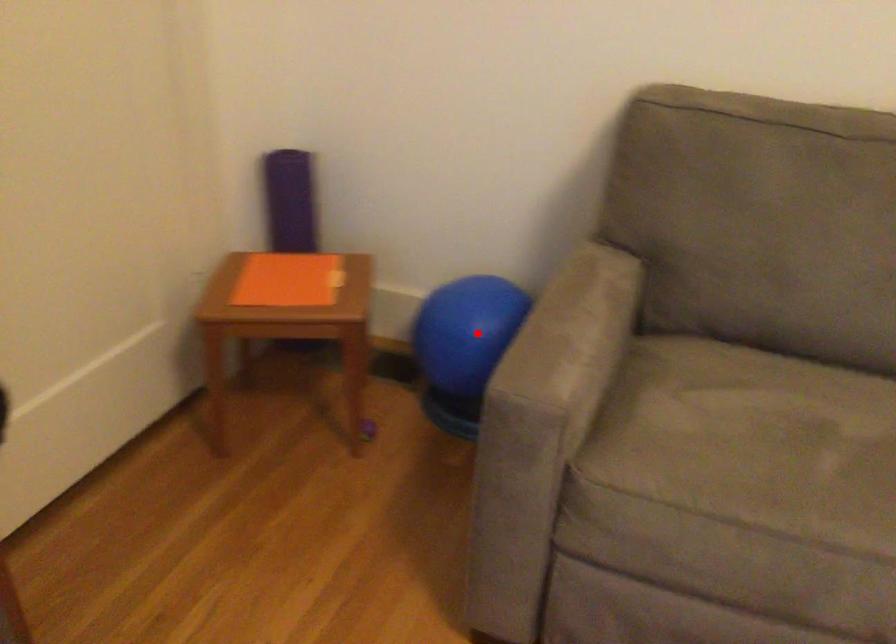
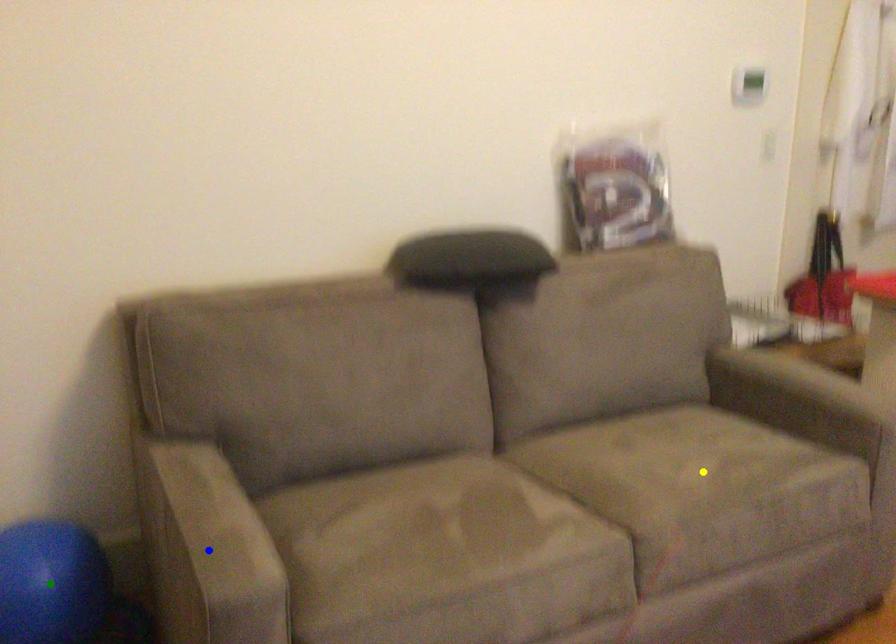
Question: I am providing you with two images of the same scene from different viewpoints. A red point is marked on the first image. You are given multiple points on the second image. Which mark in image 2 goes with the point in image 1?

Choices:
 (A) yellow point
 (B) blue point
 (C) green point

Answer: (C)